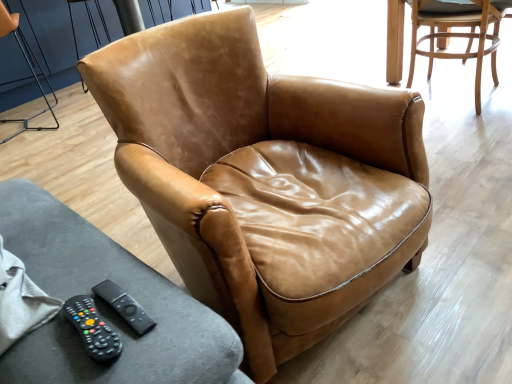
I want to click on free location to the right of cognac leather armchair at center, which ranks as the 2th chair in right-to-left order, so click(466, 220).